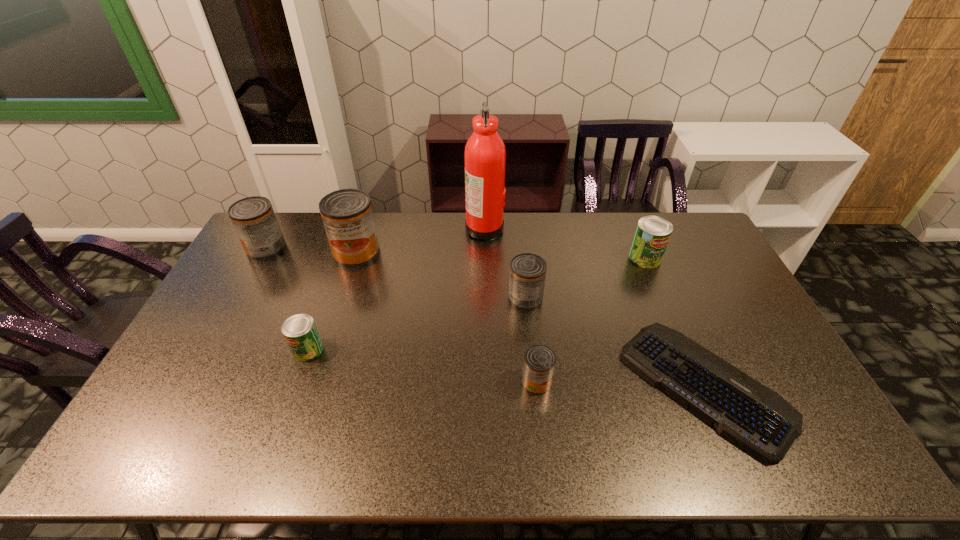
This screenshot has height=540, width=960. In order to click on empty location between the tallest object and the fourth nearest object in this screenshot , I will do `click(505, 263)`.

What are the coordinates of `vacant area that lies between the shortest object and the farther green can` in the screenshot? It's located at (675, 322).

In order to click on vacant space that's between the right green can and the leftmost can in this screenshot , I will do `click(456, 253)`.

This screenshot has width=960, height=540. Identify the location of empty space that is in between the sixth shortest object and the tallest can. (311, 251).

Where is `free space between the left green can and the nearest red can`? free space between the left green can and the nearest red can is located at coordinates (422, 366).

You are a GUI agent. You are given a task and a screenshot of the screen. Output one action in this format:
    pyautogui.click(x=<x>, y=<y>)
    Task: Click on the free space between the second tallest can and the second nearest can
    The image size is (960, 540).
    Given the screenshot: What is the action you would take?
    (x=287, y=299)

I want to click on the third closest object to the computer keyboard, so click(x=652, y=235).

In order to click on object that is the seventh closest to the tallest can in this screenshot , I will do `click(652, 235)`.

At what (x,y) coordinates should I click in order to perform the action: click on can that stands as the third closest to the third nearest can. Please return your answer as a coordinate pair (x, y). This screenshot has height=540, width=960. Looking at the image, I should click on (347, 215).

Select which can is the second closest to the fifth shortest can. Please provide its 2D coordinates. Your answer should be formatted as a tuple, i.e. [(x, y)], where the tuple contains the x and y coordinates of a point satisfying the conditions above.

[(300, 332)]